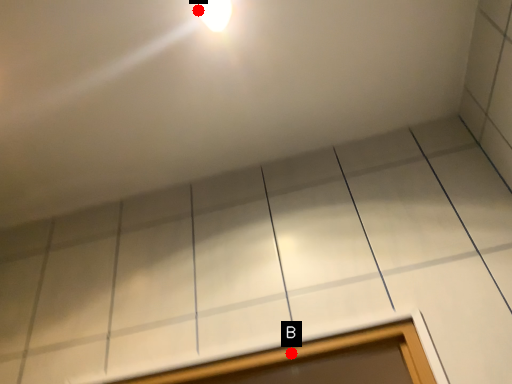
Question: Two points are circled on the image, labeled by A and B beside each circle. Among these points, which one is nearest to the camera?

Choices:
 (A) A is closer
 (B) B is closer

Answer: (A)